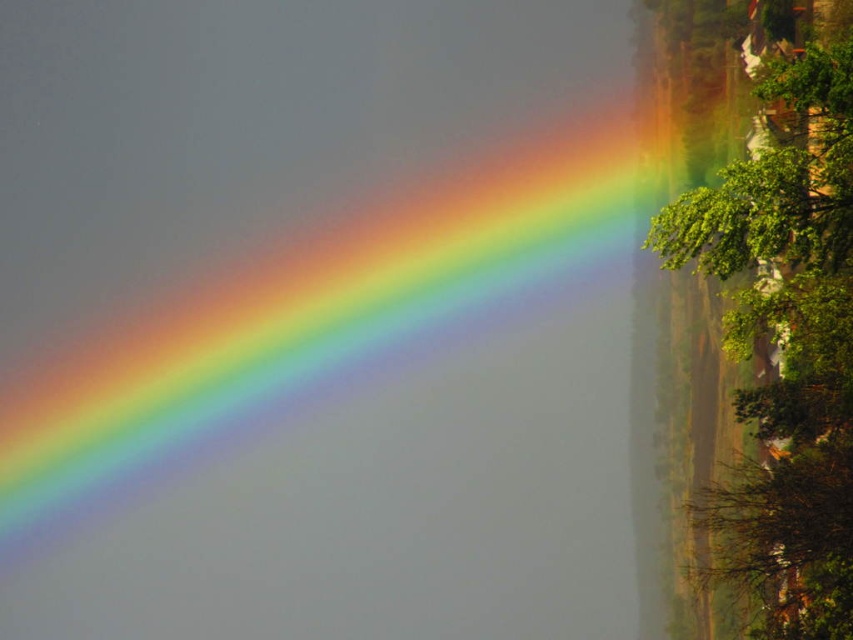
You are standing in the scene and want to take a photo of both the point at coordinates point (289,380) and point (693,195). Which point will appear closer to the camera in your photo?

Point (693,195) will appear closer to the camera in the photo because it is closer to the viewer than point (289,380), which is further away.

You are an artist trying to paint the scene. You need to decide the placement of the rainbow at upper left and green leafy tree at upper right. Based on the scene, which object should be placed higher in your painting?

The rainbow at upper left should be placed higher than the green leafy tree at upper right because the rainbow at upper left is located above the green leafy tree at upper right in the scene.

You are standing in the scene and want to locate the rainbow. According to the image, where is the rainbow located relative to the point marked at coordinates (322, 310)?

The rainbow is located at the upper left of the point marked at coordinates (322, 310).